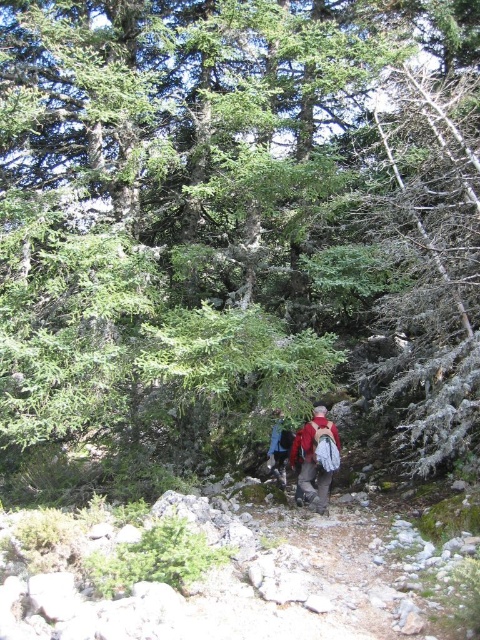
Consider the image. Is red backpack at center positioned behind blue fabric backpack at center?

No, it is in front of blue fabric backpack at center.

Can you confirm if red backpack at center is taller than blue fabric backpack at center?

No, red backpack at center is not taller than blue fabric backpack at center.

Find the location of a particular element. red backpack at center is located at coordinates (312, 460).